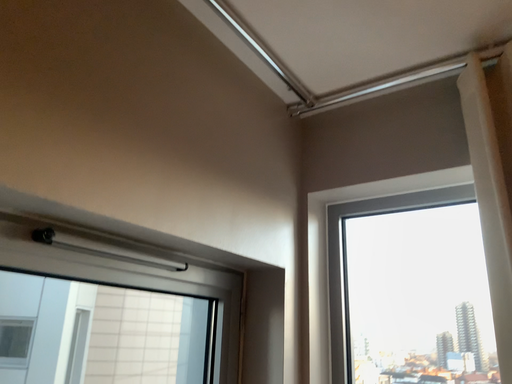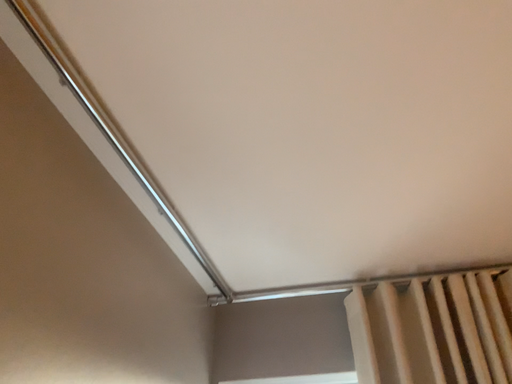
Question: Which way did the camera rotate in the video?

Choices:
 (A) rotated upward
 (B) rotated downward

Answer: (A)